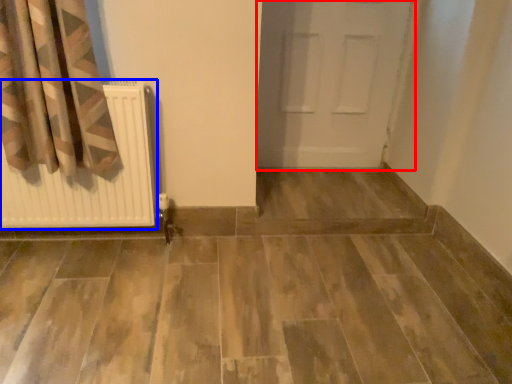
Question: Among these objects, which one is farthest to the camera, door (highlighted by a red box) or radiator (highlighted by a blue box)?

Choices:
 (A) door
 (B) radiator

Answer: (A)